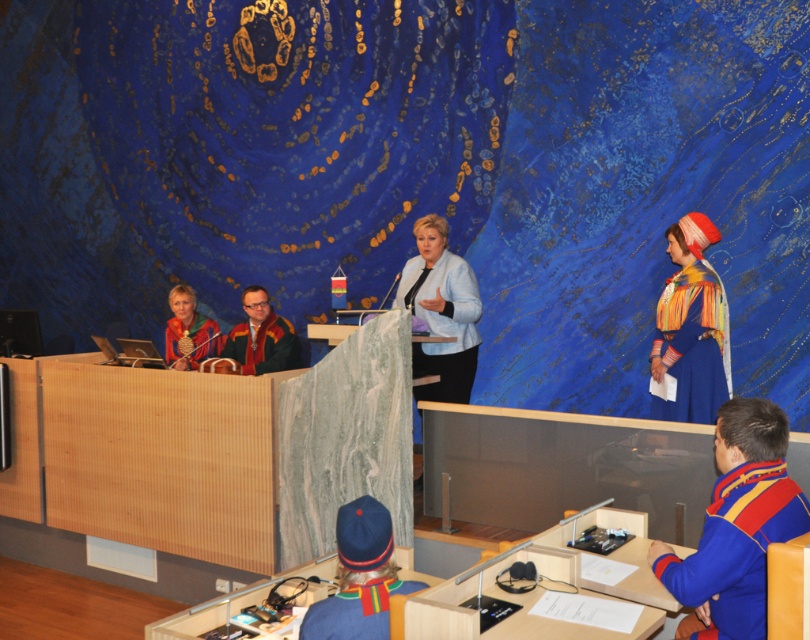
You are organizing a costume party and need to ensure that the blue velvet dress at right and the blue fabric hat at lower center can be worn together. Since the dress is larger, will the hat fit properly on top of it?

The blue velvet dress at right is bigger than the blue fabric hat at lower center, so the hat will fit properly on top of the dress since it is smaller in size.

In the image, there is a blue velvet dress at right. Where exactly is it located in terms of coordinates?

The blue velvet dress at right is located at coordinates point (x=689, y=346).

You are an observer in the room. You see the light blue fabric jacket at center and the blue fabric uniform at lower center. Which one is positioned higher in the image?

The light blue fabric jacket at center is located above the blue fabric uniform at lower center, so it is positioned higher in the image.